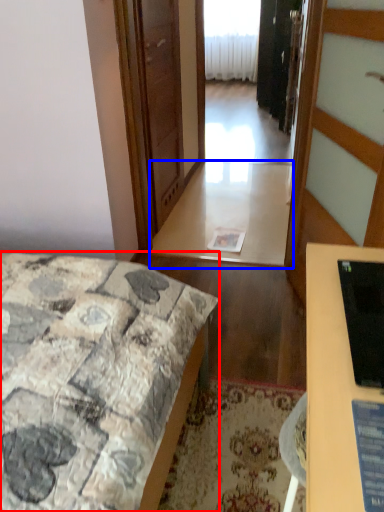
Question: Which of the following is the closest to the observer, bed (highlighted by a red box) or table (highlighted by a blue box)?

Choices:
 (A) bed
 (B) table

Answer: (A)